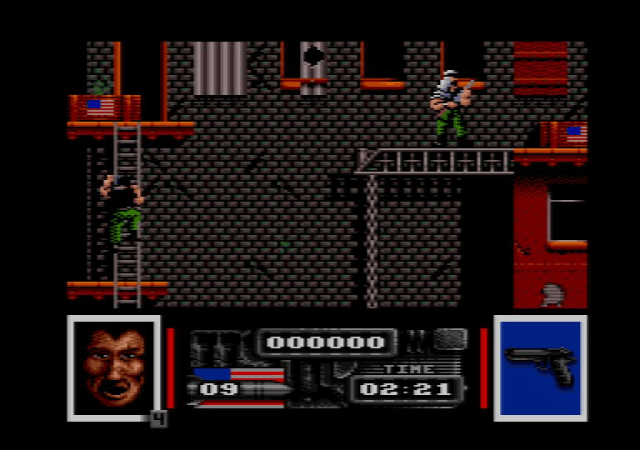
Locate an element on the screen. This screenshot has width=640, height=450. door is located at coordinates (138, 71).